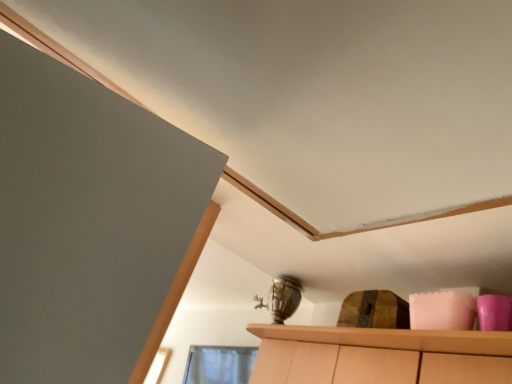
This screenshot has width=512, height=384. What do you see at coordinates (219, 364) in the screenshot? I see `transparent glass window at lower center` at bounding box center [219, 364].

Identify the location of transparent glass window at lower center. (219, 364).

Locate an element on the screen. Image resolution: width=512 pixels, height=384 pixels. transparent glass window at lower center is located at coordinates (219, 364).